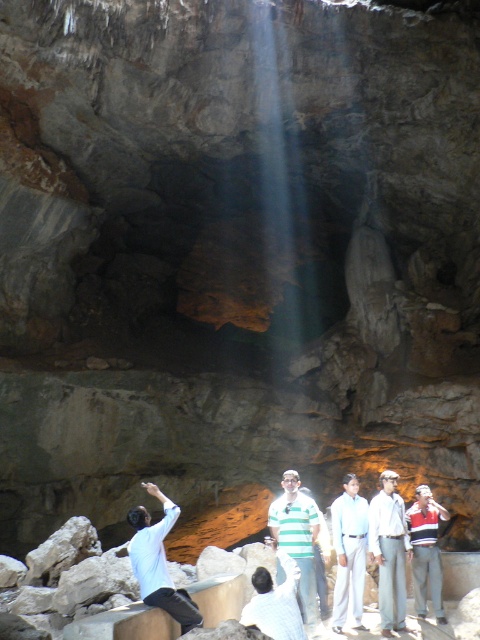
Question: Based on their relative distances, which object is farther from the light blue shirt at lower center?

Choices:
 (A) green striped shirt at center
 (B) light blue shirt at center
 (C) white cotton shirt at center

Answer: (C)

Question: Does light blue shirt at lower center have a lesser width compared to white cotton shirt at center?

Choices:
 (A) no
 (B) yes

Answer: (A)

Question: Which object is positioned farthest from the green striped shirt at center?

Choices:
 (A) white shirt at center
 (B) light blue shirt at lower center
 (C) white cotton shirt at center

Answer: (B)

Question: Considering the relative positions of green striped shirt at center and light blue shirt at center in the image provided, where is green striped shirt at center located with respect to light blue shirt at center?

Choices:
 (A) above
 (B) below

Answer: (A)

Question: Can you confirm if green striped shirt at center is wider than striped cotton shirt at center?

Choices:
 (A) no
 (B) yes

Answer: (A)

Question: Which point is farther to the camera?

Choices:
 (A) light blue shirt at center
 (B) light blue shirt at lower center
 (C) green striped shirt at center

Answer: (A)